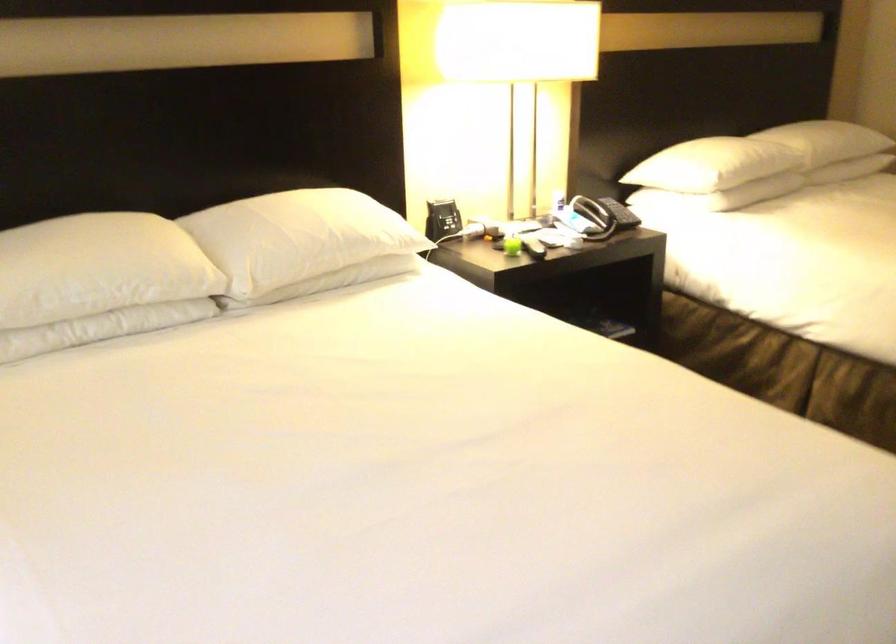
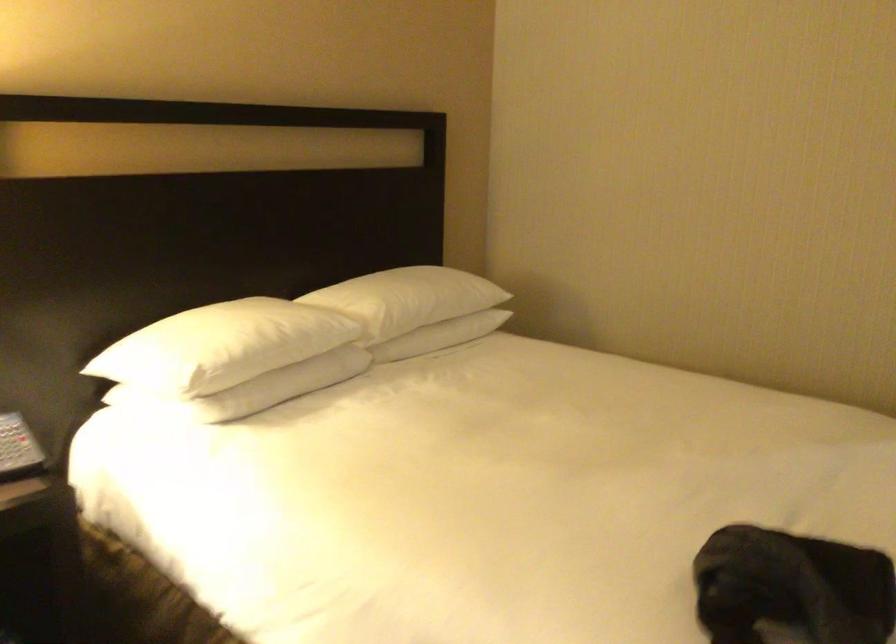
Find the pixel in the second image that matches pixel 626 214 in the first image.

(19, 449)